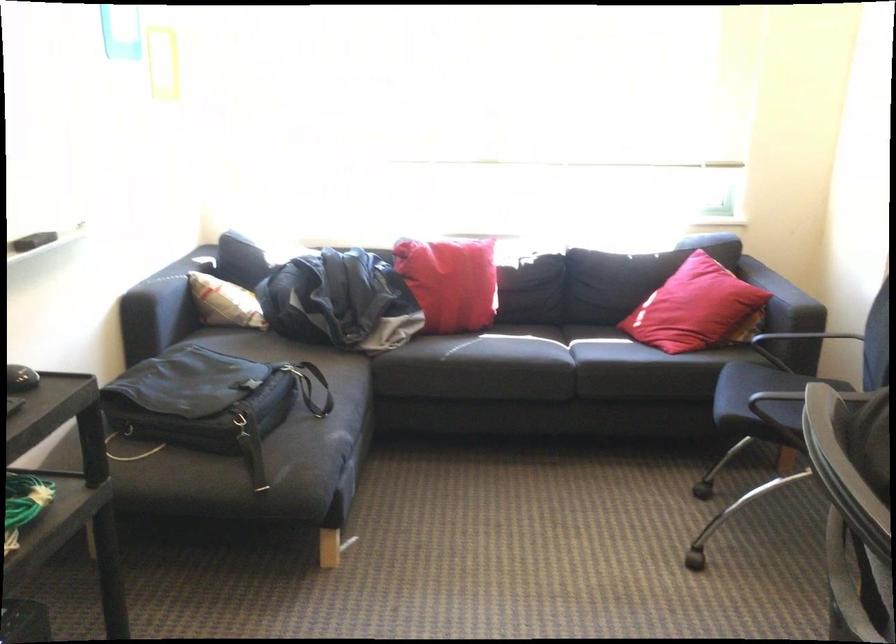
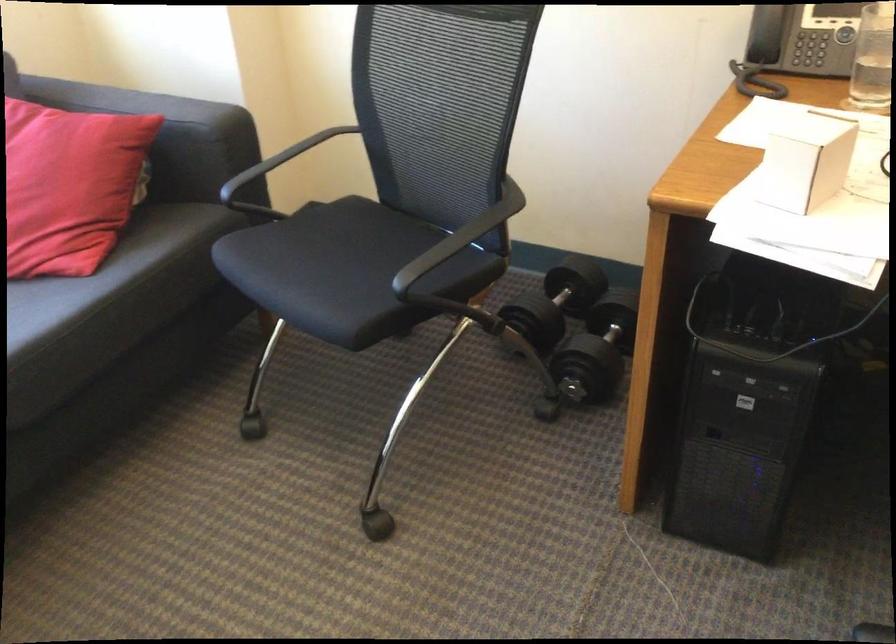
Find the pixel in the second image that matches the point at 702,303 in the first image.

(69, 185)